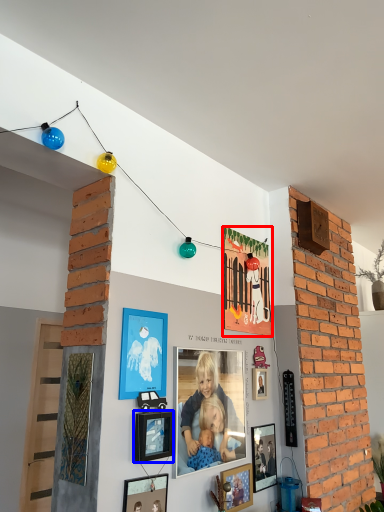
Question: Which of the following is the closest to the observer, picture frame (highlighted by a red box) or picture frame (highlighted by a blue box)?

Choices:
 (A) picture frame
 (B) picture frame

Answer: (B)